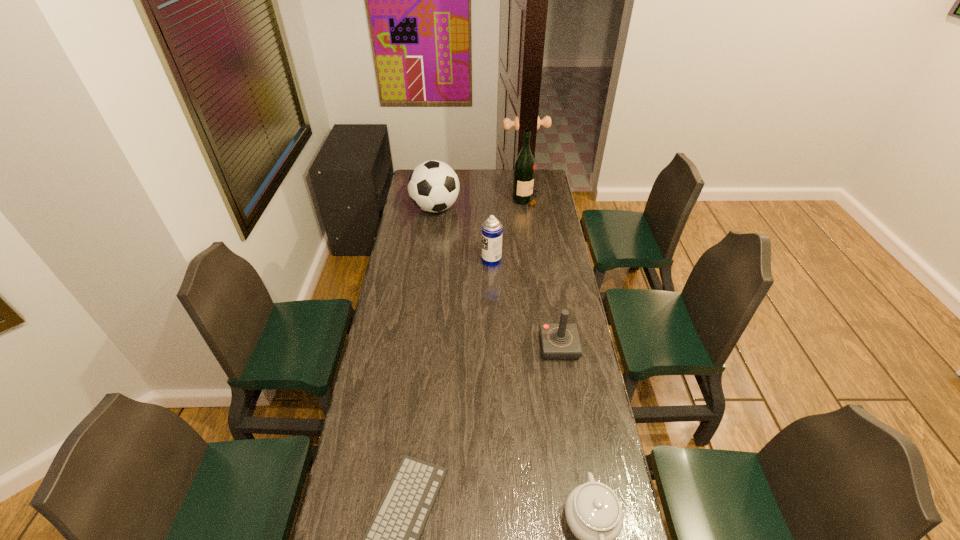
This screenshot has height=540, width=960. What are the coordinates of `vacant region located 0.120m on the label side of the aerosol can` in the screenshot? It's located at (456, 260).

I want to click on free location located 0.380m on the rectangular base of the fourth farthest object, so click(578, 461).

Locate an element on the screen. The image size is (960, 540). object situated at the left edge is located at coordinates click(x=433, y=186).

Image resolution: width=960 pixels, height=540 pixels. In order to click on wine bottle that is positioned at the right edge in this screenshot , I will do `click(524, 169)`.

Image resolution: width=960 pixels, height=540 pixels. Identify the location of joystick located at the right edge. (560, 341).

Find the location of a particular element. This screenshot has width=960, height=540. vacant region at the far edge of the desktop is located at coordinates (473, 177).

In the image, there is a desktop. Where is `free space at the left edge`? free space at the left edge is located at coordinates (417, 230).

The height and width of the screenshot is (540, 960). I want to click on vacant region at the right edge of the desktop, so click(x=548, y=261).

Locate an element on the screen. Image resolution: width=960 pixels, height=540 pixels. free space between the fourth farthest object and the soccer ball is located at coordinates pyautogui.click(x=497, y=277).

At what (x,y) coordinates should I click in order to perform the action: click on free spot between the tallest object and the joystick. Please return your answer as a coordinate pair (x, y). Image resolution: width=960 pixels, height=540 pixels. Looking at the image, I should click on (542, 274).